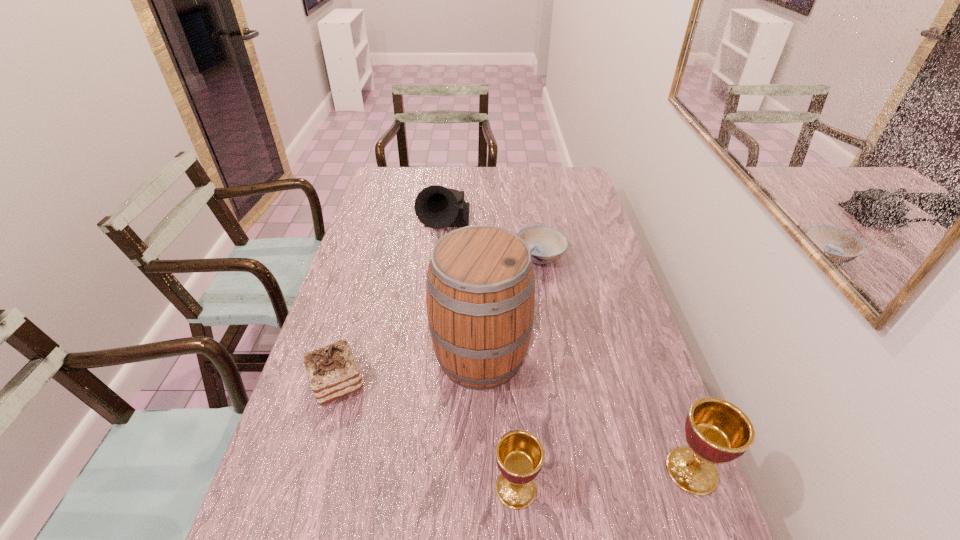
You are a GUI agent. You are given a task and a screenshot of the screen. Output one action in this format:
    pyautogui.click(x=<x>, y=<y>)
    Task: Click on the shorter chalice
    The height and width of the screenshot is (540, 960).
    Given the screenshot: What is the action you would take?
    pyautogui.click(x=520, y=455)

Locate an element on the screen. The height and width of the screenshot is (540, 960). the fourth tallest object is located at coordinates tap(520, 455).

Identify the location of the rightmost object. (717, 431).

This screenshot has width=960, height=540. Find the location of `the right chalice`. the right chalice is located at coordinates (717, 431).

Locate an element on the screen. phonograph_record is located at coordinates (437, 207).

Find the location of a particular element. The width and height of the screenshot is (960, 540). bowl is located at coordinates (546, 244).

Identify the location of the leftmost object. (332, 370).

Identify the location of chocolate cake. (332, 370).

Where is `the tallest object`? This screenshot has height=540, width=960. the tallest object is located at coordinates (480, 286).

Locate an element on the screen. The image size is (960, 540). blank area located on the left of the left chalice is located at coordinates (417, 488).